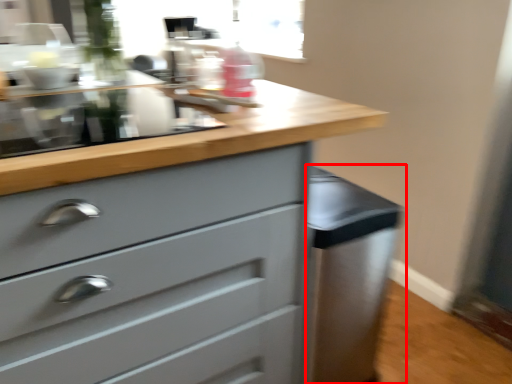
Question: Considering the relative positions of cabinetry (annotated by the red box) and chest of drawers in the image provided, where is cabinetry (annotated by the red box) located with respect to the staircase?

Choices:
 (A) right
 (B) left

Answer: (A)